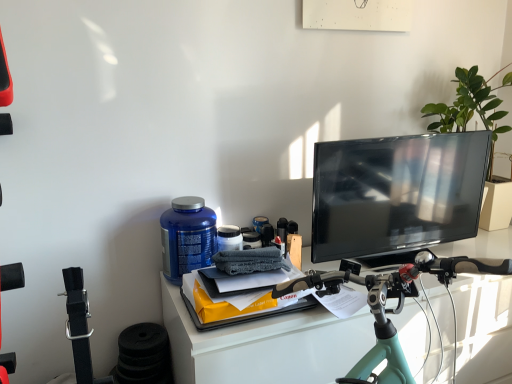
Question: Is teal matte bicycle handlebars at center taller or shorter than blue plastic bottle at center-left?

Choices:
 (A) tall
 (B) short

Answer: (A)

Question: In the image, is teal matte bicycle handlebars at center positioned in front of or behind blue plastic bottle at center-left?

Choices:
 (A) behind
 (B) front

Answer: (B)

Question: Which object is positioned farthest from the teal matte bicycle handlebars at center?

Choices:
 (A) blue plastic bottle at center-left
 (B) green leafy plant at upper right
 (C) matte black tv at right

Answer: (B)

Question: Which object is positioned closest to the teal matte bicycle handlebars at center?

Choices:
 (A) green leafy plant at upper right
 (B) matte black tv at right
 (C) blue plastic bottle at center-left

Answer: (B)